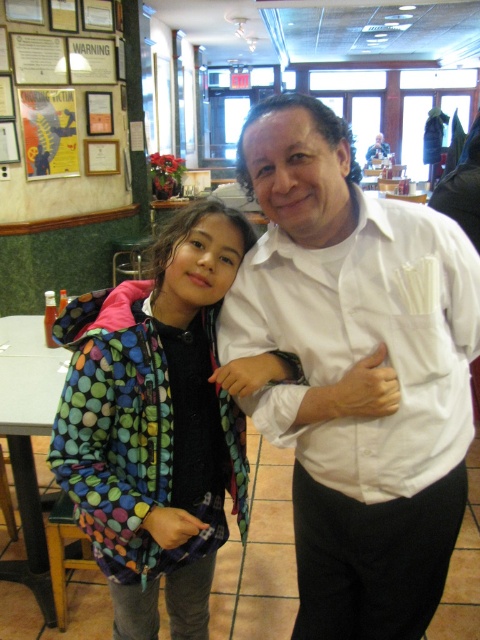
Question: Is polka dot jacket at center to the left of white glossy shirt at center from the viewer's perspective?

Choices:
 (A) no
 (B) yes

Answer: (B)

Question: From the image, what is the correct spatial relationship of white smooth shirt at center in relation to white glossy shirt at center?

Choices:
 (A) left
 (B) right

Answer: (A)

Question: Which of the following is the closest to the observer?

Choices:
 (A) white glossy shirt at center
 (B) white smooth shirt at center

Answer: (B)

Question: Which object is the closest to the white glossy shirt at center?

Choices:
 (A) white smooth shirt at center
 (B) polka dot jacket at center

Answer: (B)

Question: Does polka dot jacket at center have a greater width compared to white glossy shirt at center?

Choices:
 (A) yes
 (B) no

Answer: (B)

Question: Which of the following is the closest to the observer?

Choices:
 (A) (108, 348)
 (B) (357, 500)

Answer: (A)